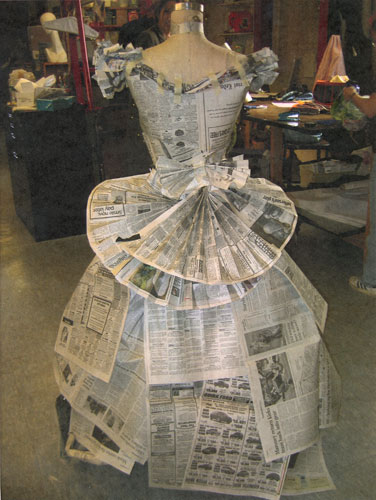
The image size is (376, 500). What are the coordinates of `dresser` in the screenshot? It's located at (57, 155).